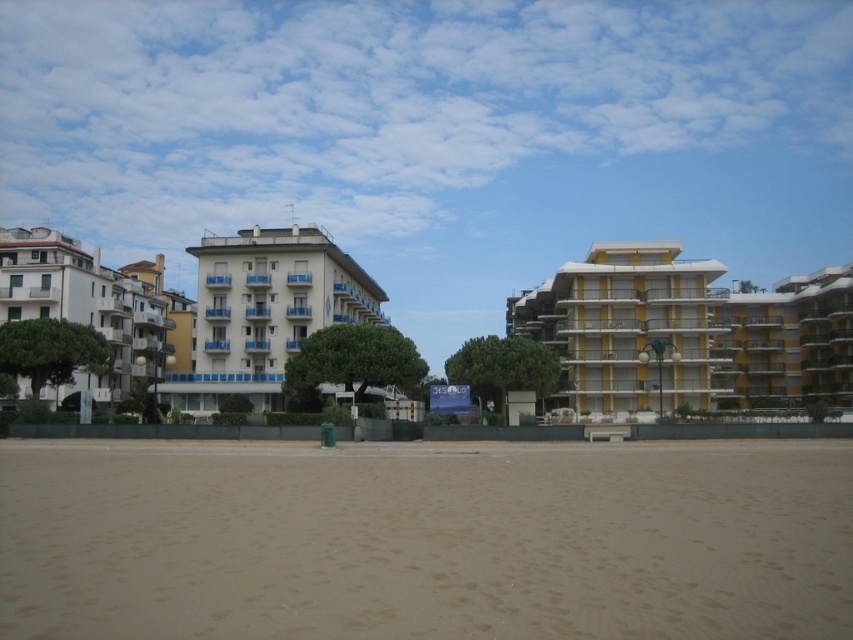
Can you confirm if yellow matte building at right is positioned to the right of white glossy building at center?

Correct, you'll find yellow matte building at right to the right of white glossy building at center.

Describe the element at coordinates (688, 332) in the screenshot. I see `yellow matte building at right` at that location.

Is point (733, 348) farther from viewer compared to point (190, 381)?

Yes, point (733, 348) is farther from viewer.

The image size is (853, 640). In order to click on yellow matte building at right in this screenshot , I will do `click(688, 332)`.

Based on the photo, who is shorter, brown sandy beach at lower center or white matte building at left?

With less height is brown sandy beach at lower center.

Who is higher up, brown sandy beach at lower center or white matte building at left?

Positioned higher is white matte building at left.

What do you see at coordinates (425, 540) in the screenshot? The image size is (853, 640). I see `brown sandy beach at lower center` at bounding box center [425, 540].

Where is `brown sandy beach at lower center`? brown sandy beach at lower center is located at coordinates (425, 540).

Does yellow matte building at right have a lesser width compared to white matte building at left?

Incorrect, yellow matte building at right's width is not less than white matte building at left's.

Locate an element on the screen. The image size is (853, 640). yellow matte building at right is located at coordinates (688, 332).

Who is more distant from viewer, (698,364) or (138,314)?

The point (138,314) is behind.

At what (x,y) coordinates should I click in order to perform the action: click on yellow matte building at right. Please return your answer as a coordinate pair (x, y). Looking at the image, I should click on (688, 332).